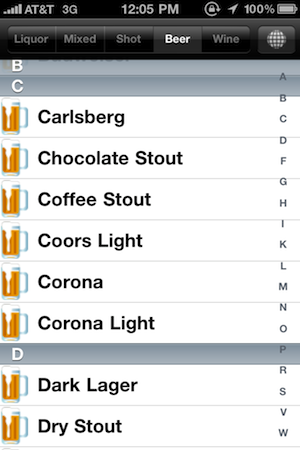
Find the location of a particular element. The width and height of the screenshot is (300, 450). beer mugs is located at coordinates (9, 126), (9, 289), (15, 318), (13, 387), (13, 433), (13, 156), (13, 206), (13, 239).